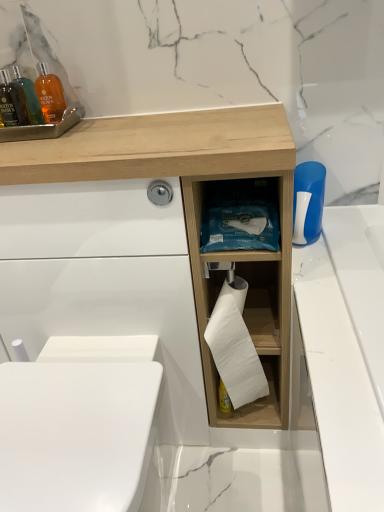
Question: From their relative heights in the image, would you say translucent orange bottle at upper left, positioned as the 2th mouthwash in front-to-back order, is taller or shorter than wooden tissue box at center?

Choices:
 (A) tall
 (B) short

Answer: (B)

Question: Relative to wooden tissue box at center, is translucent orange bottle at upper left, positioned as the 2th mouthwash in front-to-back order, in front or behind?

Choices:
 (A) front
 (B) behind

Answer: (B)

Question: Estimate the real-world distances between objects in this image. Which object is farther from the blue plastic brush at right?

Choices:
 (A) translucent orange bottle at upper left, positioned as the 2th mouthwash in front-to-back order
 (B) translucent amber bottle at upper left, the 2th mouthwash positioned from the back
 (C) wooden tissue box at center
 (D) white glossy toilet bowl at lower left
 (E) white matte toilet paper at center

Answer: (B)

Question: Considering the real-world distances, which object is farthest from the blue plastic brush at right?

Choices:
 (A) translucent amber bottle at upper left, the 2th mouthwash positioned from the back
 (B) translucent orange bottle at upper left, marked as the 1th mouthwash in a back-to-front arrangement
 (C) wooden tissue box at center
 (D) white glossy toilet bowl at lower left
 (E) white matte toilet paper at center

Answer: (A)